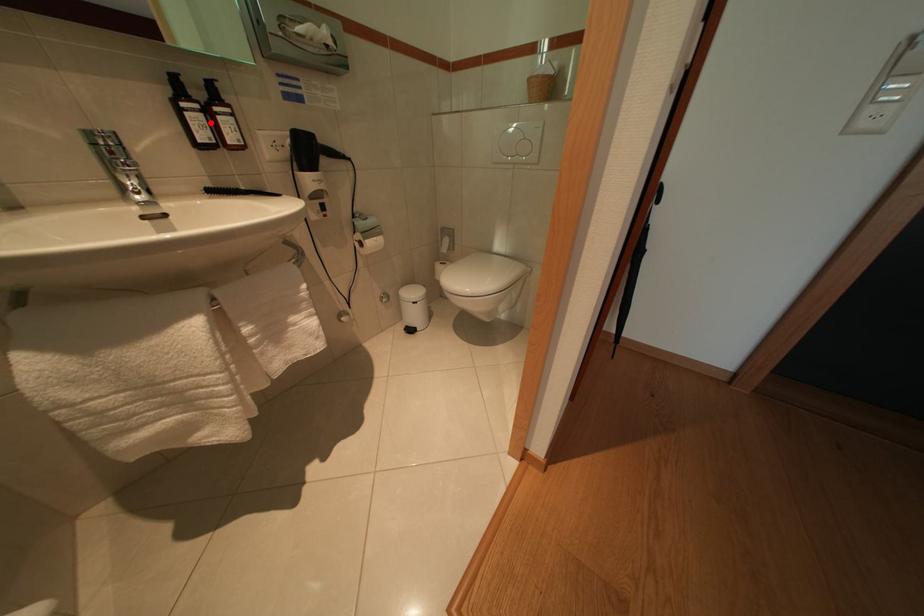
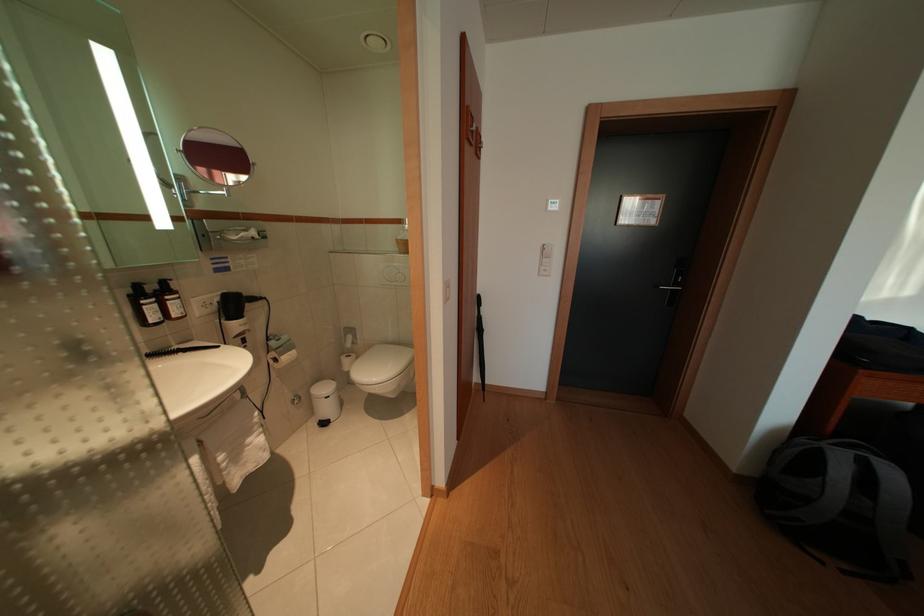
Find the pixel in the second image that matches the highlighted location in the first image.

(164, 312)